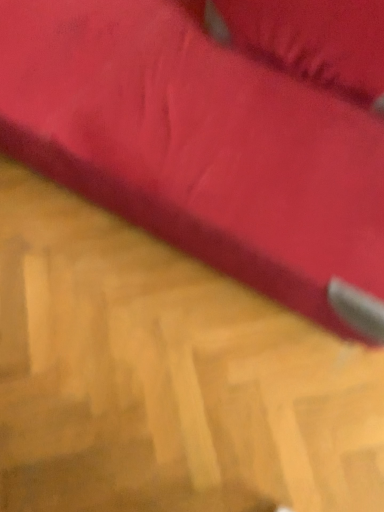
What do you see at coordinates (217, 134) in the screenshot? I see `matte red suitcase at upper right` at bounding box center [217, 134].

Locate an element on the screen. The width and height of the screenshot is (384, 512). matte red suitcase at upper right is located at coordinates (217, 134).

This screenshot has width=384, height=512. Find the location of `matte red suitcase at upper right`. matte red suitcase at upper right is located at coordinates (217, 134).